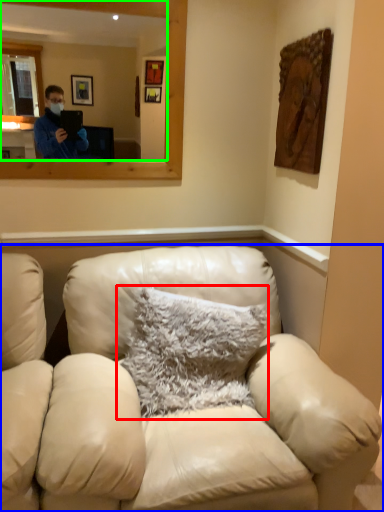
Question: Considering the real-world distances, which object is farthest from pillow (highlighted by a red box)? studio couch (highlighted by a blue box) or mirror (highlighted by a green box)?

Choices:
 (A) studio couch
 (B) mirror

Answer: (B)